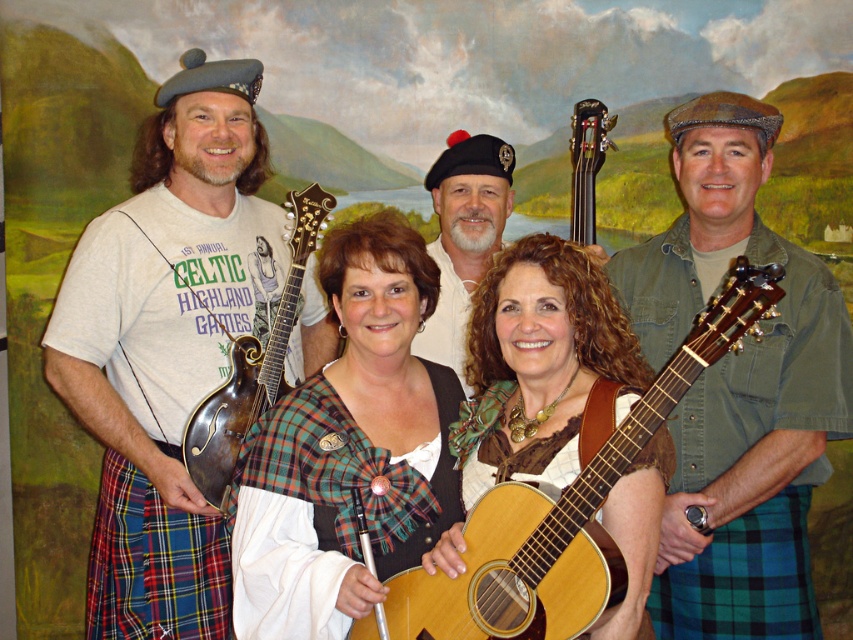
You are a photographer adjusting the lighting for a group photo. The green denim shirt at center and the wooden mandolin at left are in your frame. You need to ensure there is at least 40 inches between them for proper lighting setup. Based on the scene description, is the current distance sufficient?

The green denim shirt at center is 38.51 inches from the wooden mandolin at left. Since 38.51 inches is less than the required 40 inches, the current distance is insufficient for the lighting setup.

You are a photographer trying to capture a closeup of the green plaid kilt at lower right and the wooden mandolin at left. Which object should you focus on first if you want to ensure both are in frame without moving the camera?

The green plaid kilt at lower right should be focused on first since it occupies less space than the wooden mandolin at left, allowing the photographer to adjust the zoom to include both in the frame.